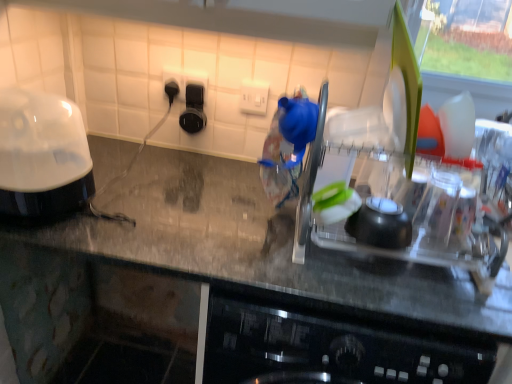
Question: Considering the positions of point tap(119, 196) and point tap(416, 236), is point tap(119, 196) closer or farther from the camera than point tap(416, 236)?

Choices:
 (A) closer
 (B) farther

Answer: (B)

Question: In the image, is transparent plastic dish rack at center on the left side or the right side of clear plastic dish rack at center?

Choices:
 (A) right
 (B) left

Answer: (B)

Question: Which object is positioned closest to the black glossy food processor at left?

Choices:
 (A) black plastic outlet at upper center, the second electric outlet viewed from the right
 (B) white plastic electric outlet at center, which is counted as the 2th electric outlet, starting from the left
 (C) transparent plastic dish rack at center
 (D) clear plastic dish rack at center

Answer: (C)

Question: Which object is the farthest from the transparent plastic dish rack at center?

Choices:
 (A) black plastic outlet at upper center, the second electric outlet viewed from the right
 (B) clear plastic dish rack at center
 (C) white plastic electric outlet at center, which is counted as the 2th electric outlet, starting from the left
 (D) black glossy food processor at left

Answer: (A)